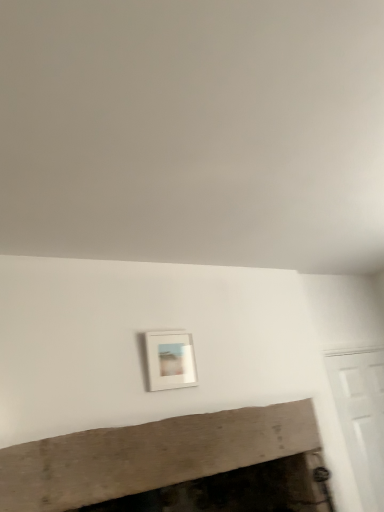
At what (x,y) coordinates should I click in order to perform the action: click on white matte picture frame at center. Please return your answer as a coordinate pair (x, y). Image resolution: width=384 pixels, height=512 pixels. Looking at the image, I should click on 170,360.

The height and width of the screenshot is (512, 384). What do you see at coordinates (170, 360) in the screenshot? I see `white matte picture frame at center` at bounding box center [170, 360].

What do you see at coordinates (175, 466) in the screenshot? The height and width of the screenshot is (512, 384). I see `wooden mantel at lower center` at bounding box center [175, 466].

What is the approximate height of wooden mantel at lower center?

wooden mantel at lower center is 2.04 inches tall.

The image size is (384, 512). In order to click on wooden mantel at lower center in this screenshot , I will do `click(175, 466)`.

This screenshot has width=384, height=512. I want to click on white matte picture frame at center, so click(x=170, y=360).

Is white matte picture frame at center to the right of wooden mantel at lower center from the viewer's perspective?

Indeed, white matte picture frame at center is positioned on the right side of wooden mantel at lower center.

Which object is closer to the camera, white matte picture frame at center or wooden mantel at lower center?

wooden mantel at lower center.

Considering the points (177, 332) and (80, 481), which point is behind, point (177, 332) or point (80, 481)?

The point (177, 332) is more distant.

From the image's perspective, between white matte picture frame at center and wooden mantel at lower center, which one is located above?

white matte picture frame at center.

From a real-world perspective, which object rests below the other?

wooden mantel at lower center, from a real-world perspective.

Based on the photo, considering the relative sizes of white matte picture frame at center and wooden mantel at lower center in the image provided, is white matte picture frame at center thinner than wooden mantel at lower center?

Yes.

Does white matte picture frame at center have a lesser height compared to wooden mantel at lower center?

No.

Which of these two, white matte picture frame at center or wooden mantel at lower center, is smaller?

white matte picture frame at center is smaller.

Is white matte picture frame at center located outside wooden mantel at lower center?

Yes, white matte picture frame at center is not within wooden mantel at lower center.

Is white matte picture frame at center far away from wooden mantel at lower center?

No, white matte picture frame at center is not far from wooden mantel at lower center.

Does white matte picture frame at center turn towards wooden mantel at lower center?

No, white matte picture frame at center is not turned towards wooden mantel at lower center.

Locate an element on the screen. Image resolution: width=384 pixels, height=512 pixels. picture frame above the wooden mantel at lower center (from a real-world perspective) is located at coordinates (170, 360).

Does wooden mantel at lower center appear on the right side of white matte picture frame at center?

No, wooden mantel at lower center is not to the right of white matte picture frame at center.

Does wooden mantel at lower center come in front of white matte picture frame at center?

Yes, it is.

Between point (290, 490) and point (155, 359), which one is positioned behind?

The point (290, 490) is farther from the camera.

From the image's perspective, is wooden mantel at lower center on top of white matte picture frame at center?

No.

From a real-world perspective, is wooden mantel at lower center on top of white matte picture frame at center?

No, from a real-world perspective, wooden mantel at lower center is not over white matte picture frame at center

Does wooden mantel at lower center have a lesser width compared to white matte picture frame at center?

No.

Is wooden mantel at lower center shorter than white matte picture frame at center?

Yes.

Who is bigger, wooden mantel at lower center or white matte picture frame at center?

With larger size is wooden mantel at lower center.

Would you say wooden mantel at lower center is inside or outside white matte picture frame at center?

wooden mantel at lower center is not inside white matte picture frame at center, it's outside.

Is wooden mantel at lower center with white matte picture frame at center?

There is a gap between wooden mantel at lower center and white matte picture frame at center.

Is wooden mantel at lower center positioned with its back to white matte picture frame at center?

No, wooden mantel at lower center is not facing away from white matte picture frame at center.

What's the angular difference between wooden mantel at lower center and white matte picture frame at center's facing directions?

The facing directions of wooden mantel at lower center and white matte picture frame at center are 90.1 degrees apart.

Identify the location of fireplace that appears on the left of white matte picture frame at center. Image resolution: width=384 pixels, height=512 pixels. (175, 466).

Find the location of a particular element. Image resolution: width=384 pixels, height=512 pixels. fireplace on the left of white matte picture frame at center is located at coordinates (175, 466).

Where is `picture frame located on the right of wooden mantel at lower center`? picture frame located on the right of wooden mantel at lower center is located at coordinates (170, 360).